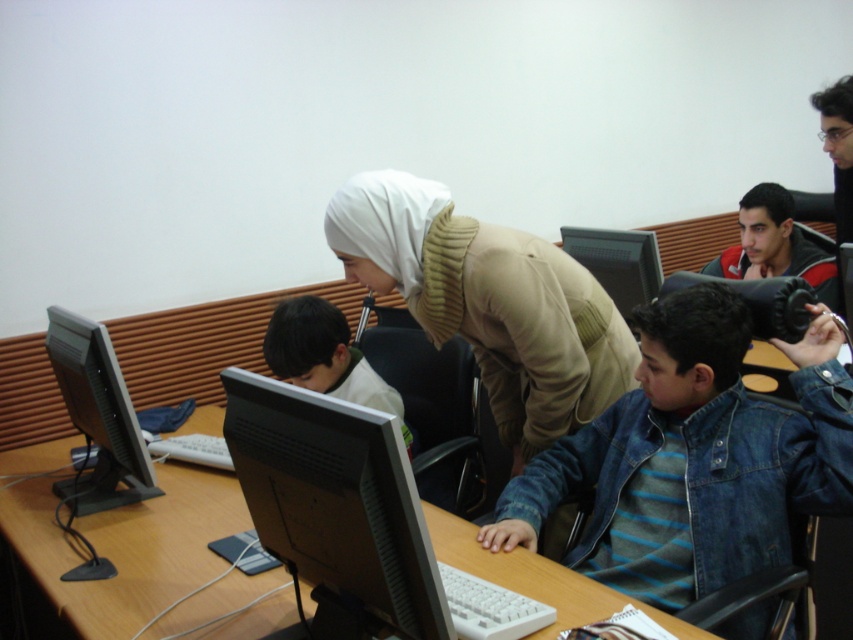
Question: Considering the real-world distances, which object is closest to the dark blue denim jacket at upper right?

Choices:
 (A) denim jacket at lower right
 (B) silver glossy monitor at center
 (C) beige knit sweater at center
 (D) black glossy monitor at left

Answer: (C)

Question: Which is nearer to the wooden table at center?

Choices:
 (A) silver glossy monitor at center
 (B) dark blue denim jacket at upper right
 (C) black glossy monitor at left

Answer: (C)

Question: In this image, where is silver glossy monitor at center located relative to matte black monitor at upper center?

Choices:
 (A) left
 (B) right

Answer: (A)

Question: Can you confirm if beige knit sweater at center is thinner than matte black monitor at upper center?

Choices:
 (A) yes
 (B) no

Answer: (B)

Question: Among these points, which one is farthest from the camera?

Choices:
 (A) (135, 544)
 (B) (570, 237)

Answer: (B)

Question: Does wooden table at center appear under silver glossy monitor at center?

Choices:
 (A) no
 (B) yes

Answer: (B)